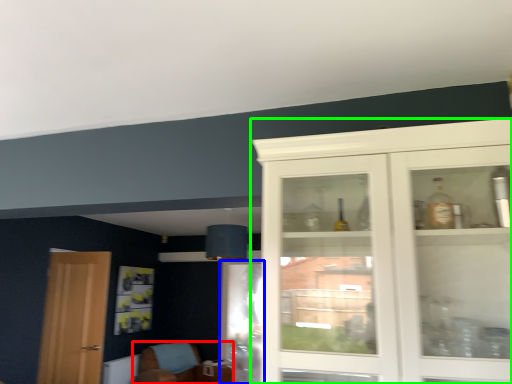
Question: Based on their relative distances, which object is nearer to chair (highlighted by a red box)? Choose from screen door (highlighted by a blue box) and cabinetry (highlighted by a green box).

Choices:
 (A) screen door
 (B) cabinetry

Answer: (A)